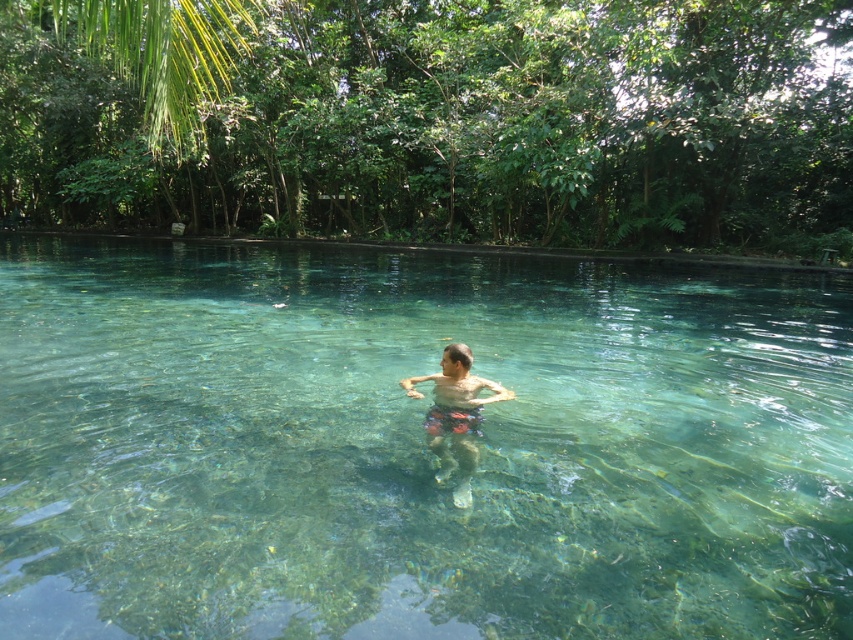
Is point (346, 554) more distant than point (465, 413)?

No, (346, 554) is in front of (465, 413).

Can you confirm if clear glass pool at center is positioned to the left of multicolored swim trunks at center?

Incorrect, clear glass pool at center is not on the left side of multicolored swim trunks at center.

This screenshot has height=640, width=853. Describe the element at coordinates (416, 445) in the screenshot. I see `clear glass pool at center` at that location.

You are a GUI agent. You are given a task and a screenshot of the screen. Output one action in this format:
    pyautogui.click(x=<x>, y=<y>)
    Task: Click on the clear glass pool at center
    This screenshot has width=853, height=640.
    Given the screenshot: What is the action you would take?
    pyautogui.click(x=416, y=445)